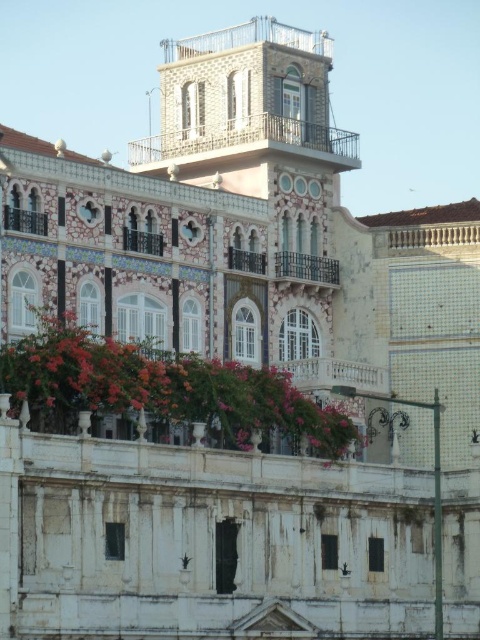
You are an architect analyzing the building. Which balcony, the white stone balcony at center or the metallic wrought iron balcony at upper left, has a larger size?

The metallic wrought iron balcony at upper left is larger than the white stone balcony at center.

You are a painter standing on the rustic wood balcony at center, and you want to paint the vivid pink petals at center. Considering their sizes, will the petals appear larger or smaller than the balcony in your painting?

The vivid pink petals at center are wider than the rustic wood balcony at center, so in the painting, the petals will appear larger than the balcony.